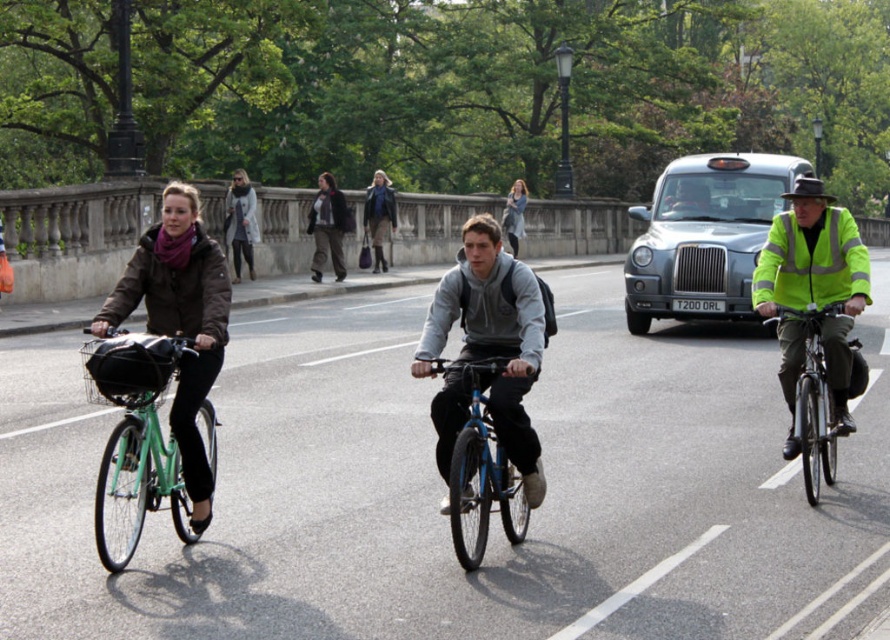
Is green matte bicycle at center bigger than high-visibility yellow safety vest at right?

Indeed, green matte bicycle at center has a larger size compared to high-visibility yellow safety vest at right.

Which of these two, green matte bicycle at center or high-visibility yellow safety vest at right, stands shorter?

high-visibility yellow safety vest at right

The height and width of the screenshot is (640, 890). I want to click on green matte bicycle at center, so click(441, 488).

Between matte brown jacket at left and matte brown coat at center, which one is positioned lower?

Positioned lower is matte brown jacket at left.

Does matte brown jacket at left have a lesser height compared to matte brown coat at center?

No.

Is point (199, 438) farther from camera compared to point (328, 232)?

No, it is in front of (328, 232).

Identify the location of matte brown jacket at left. This screenshot has width=890, height=640. (180, 321).

Who is positioned more to the left, high-visibility yellow safety vest at right or matte brown coat at center?

matte brown coat at center

Can you confirm if high-visibility yellow safety vest at right is wider than matte brown coat at center?

Yes.

Who is more distant from viewer, [777,257] or [321,241]?

Point [321,241]

Locate an element on the screen. Image resolution: width=890 pixels, height=640 pixels. high-visibility yellow safety vest at right is located at coordinates 810,260.